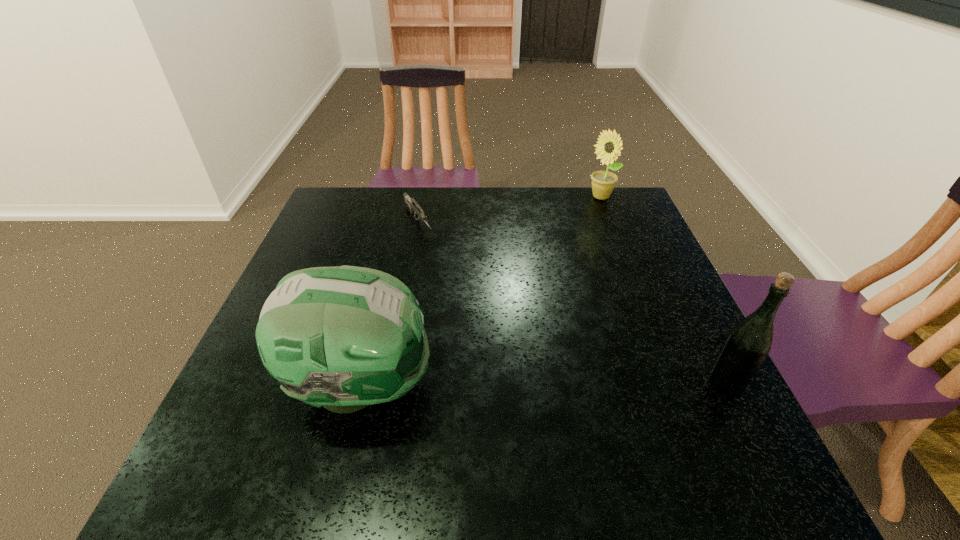
Find the location of `object that is at the near left corner`. object that is at the near left corner is located at coordinates (345, 337).

I want to click on object at the far right corner, so click(x=609, y=145).

This screenshot has width=960, height=540. I want to click on object that is at the near right corner, so click(749, 342).

Identify the location of vacant space at the far edge of the desktop. (383, 194).

Locate an element on the screen. This screenshot has height=540, width=960. vacant area at the near edge of the desktop is located at coordinates (635, 422).

Find the location of a particular element. This screenshot has width=960, height=540. vacant area at the left edge is located at coordinates (298, 265).

At what (x,y) coordinates should I click in order to perform the action: click on vacant space at the far left corner of the desktop. Please return your answer as a coordinate pair (x, y). Looking at the image, I should click on (361, 188).

Find the location of a particular element. The width and height of the screenshot is (960, 540). vacant region at the near left corner of the desktop is located at coordinates (258, 423).

This screenshot has width=960, height=540. What are the coordinates of `vacant space at the far right corner of the desktop` in the screenshot? It's located at click(625, 220).

The image size is (960, 540). In order to click on vacant region between the rightmost object and the football helmet in this screenshot , I will do `click(543, 384)`.